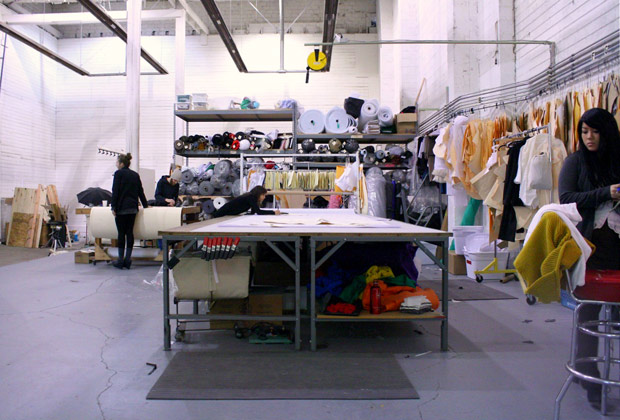
At what (x,y) coordinates should I click in order to perform the action: click on metal table. Please return your answer as a coordinate pair (x, y). Looking at the image, I should click on (320, 233).